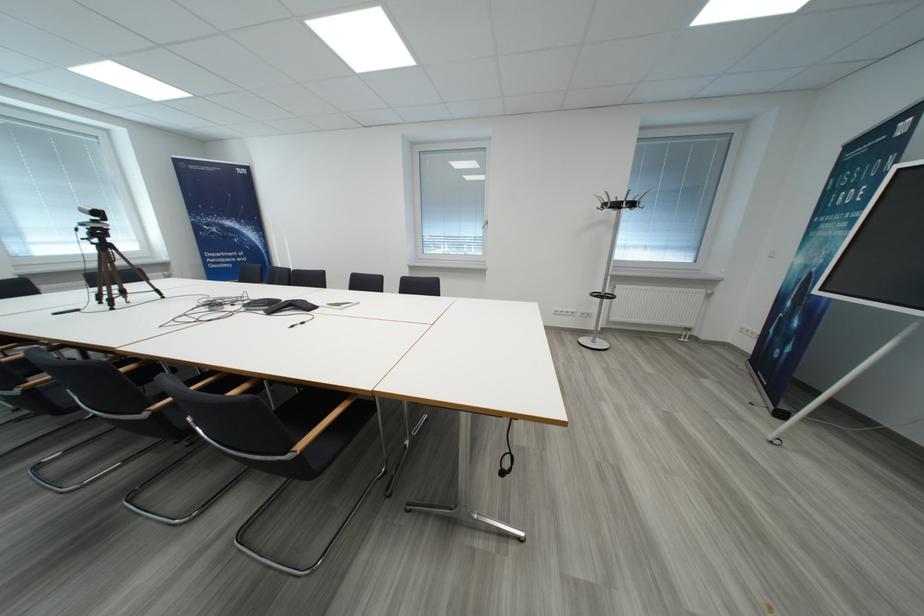
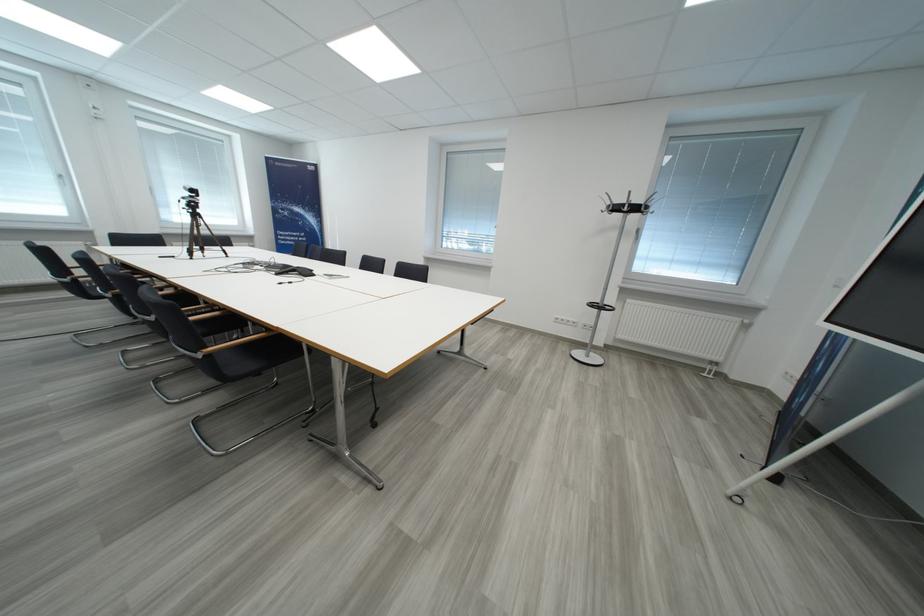
Question: In a continuous first-person perspective shot, in which direction is the camera moving?

Choices:
 (A) Left
 (B) Right
 (C) Forward
 (D) Backward

Answer: (B)